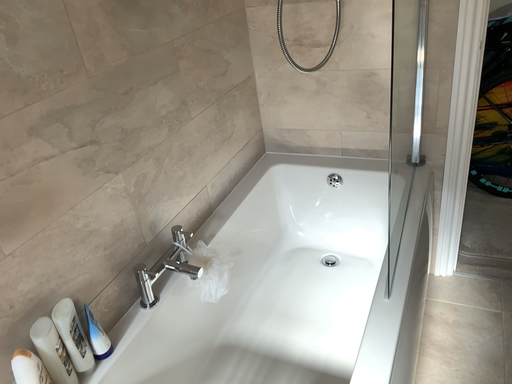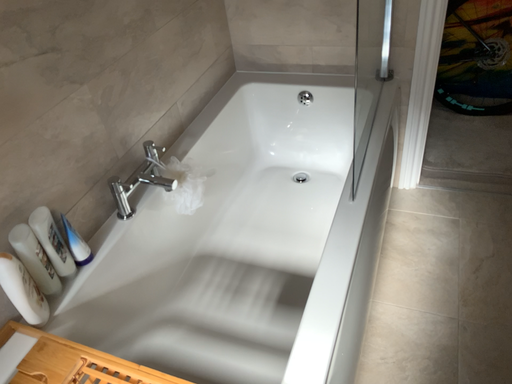
Question: Which way did the camera rotate in the video?

Choices:
 (A) rotated upward
 (B) rotated downward

Answer: (B)